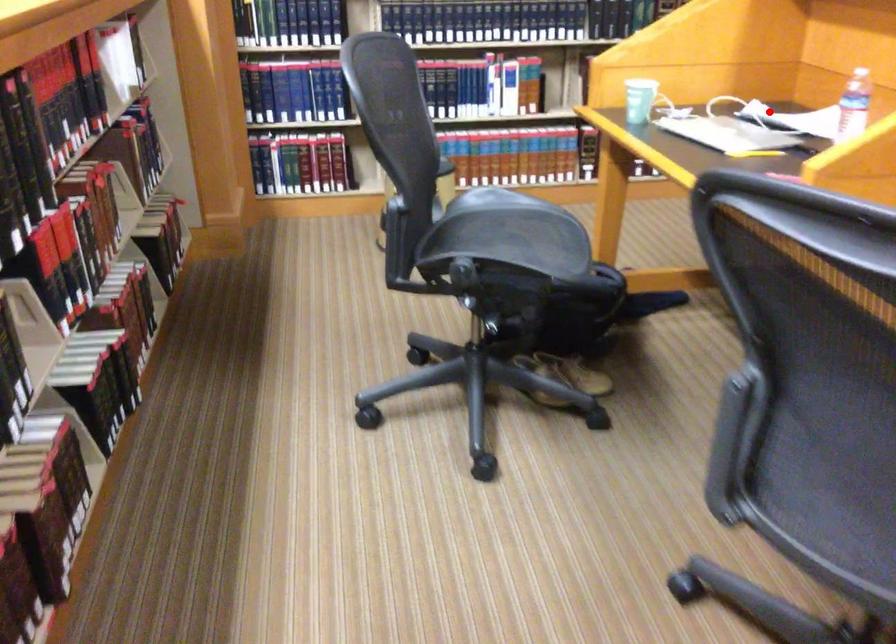
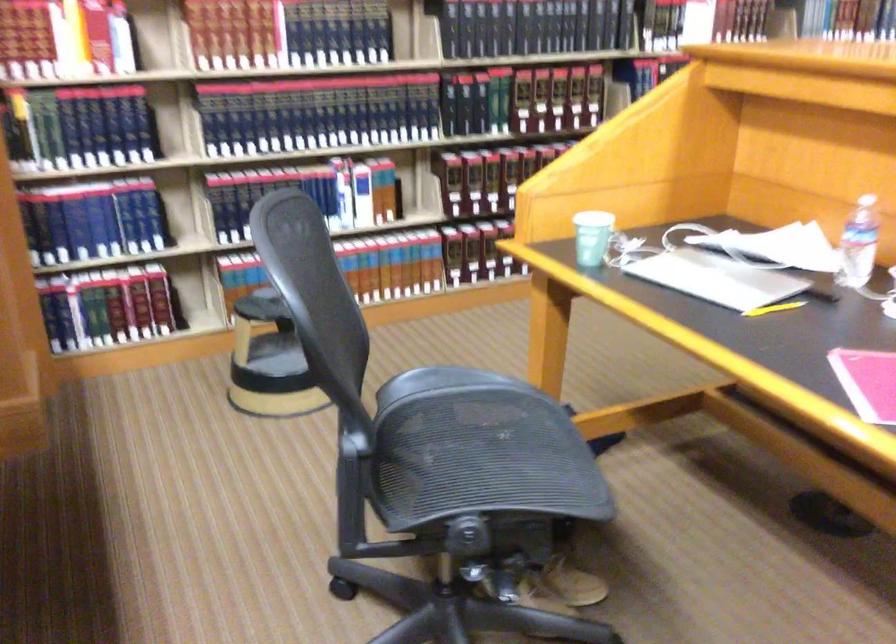
Where in the second image is the point corresponding to the highlighted location from the first image?

(739, 247)